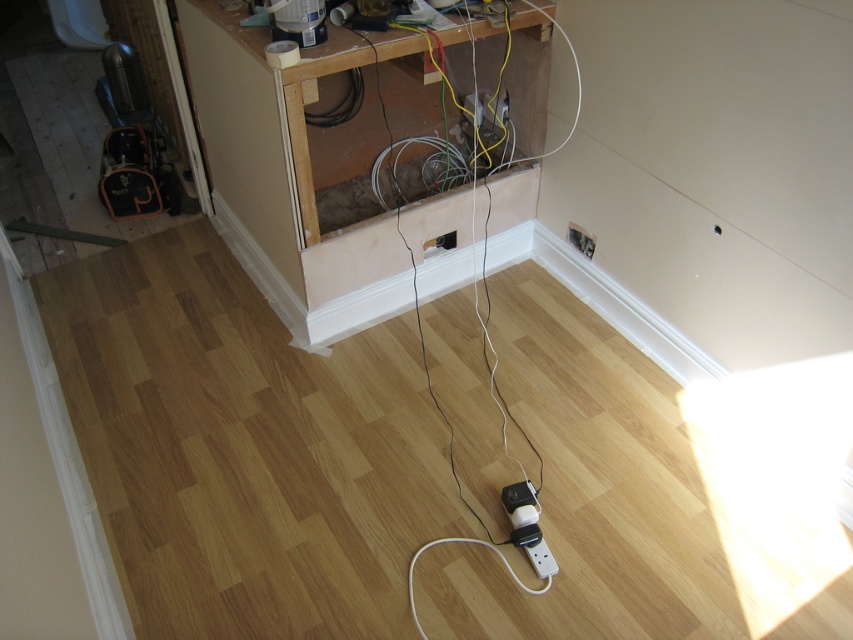
Question: Is the position of white plastic electric outlet at lower right more distant than that of white plastic electric outlet at center?

Choices:
 (A) no
 (B) yes

Answer: (B)

Question: Which object is closer to the camera taking this photo?

Choices:
 (A) white plastic electric outlet at lower right
 (B) white plastic electric outlet at center

Answer: (B)

Question: Does white plastic electric outlet at lower right have a lesser width compared to white plastic electric outlet at center?

Choices:
 (A) yes
 (B) no

Answer: (A)

Question: Which point is closer to the camera?

Choices:
 (A) (432, 253)
 (B) (585, 236)

Answer: (B)

Question: Among these points, which one is nearest to the camera?

Choices:
 (A) (567, 234)
 (B) (439, 236)

Answer: (B)

Question: Can you confirm if white plastic electric outlet at lower right is positioned below white plastic electric outlet at center?

Choices:
 (A) no
 (B) yes

Answer: (A)